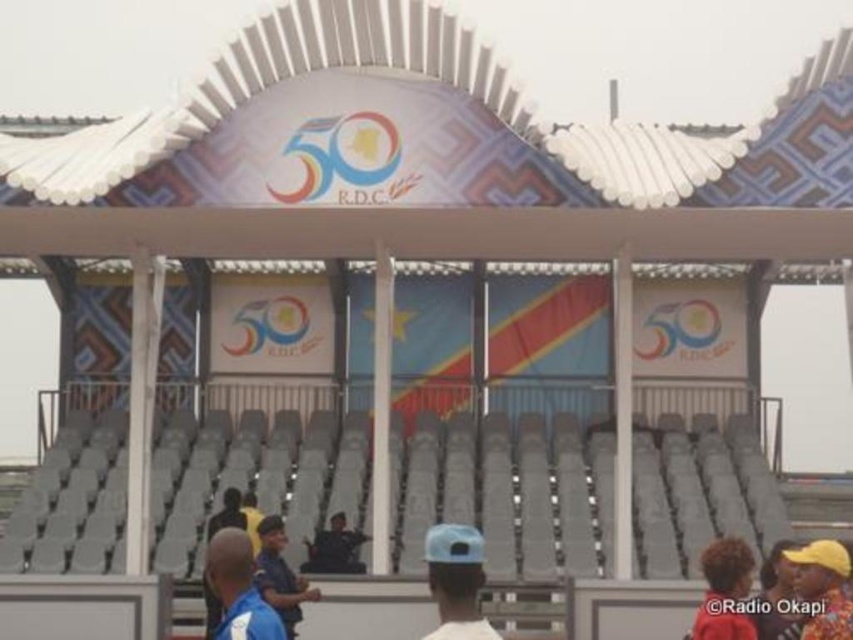
You are a stage designer checking the visibility of decorations. The yellow fabric hat at upper right and the dark blue fabric jacket at center are both part of the celebratory theme. Based on their positions and sizes, which decoration might block the other from view if placed closer to the front of the stage?

The yellow fabric hat at upper right might be wider than the dark blue fabric jacket at center, so if placed closer to the front, it could potentially block the jacket from view due to its greater width.

You are standing on the stage at the 50th anniversary event. There is a red fabric person at lower right. Where exactly is the red fabric person located on the stage? Please provide coordinates in the format of x,y where x and y are between 0 and 1, with 0,0 being the bottom left corner and 1,1 being the top right corner.

The red fabric person at lower right is located at coordinates [724,592].